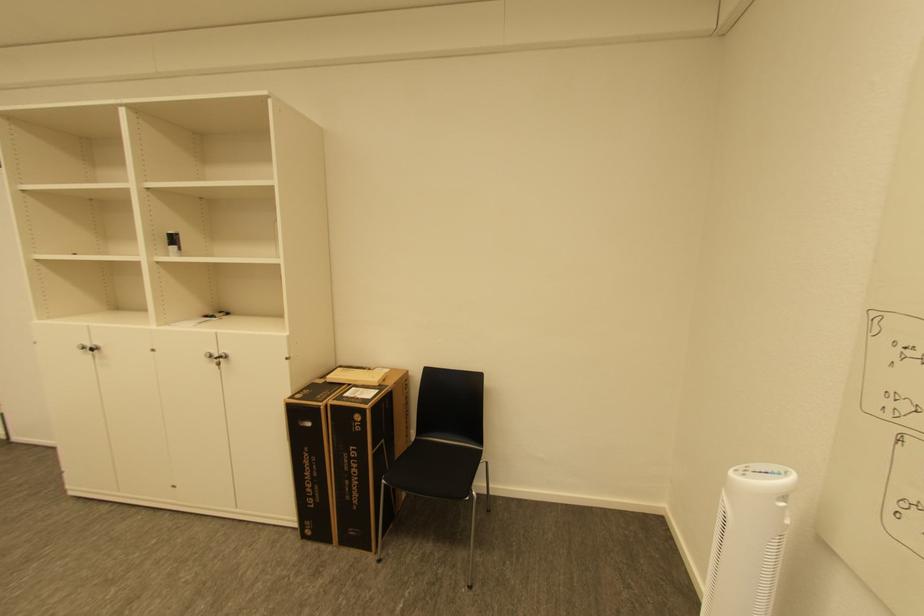
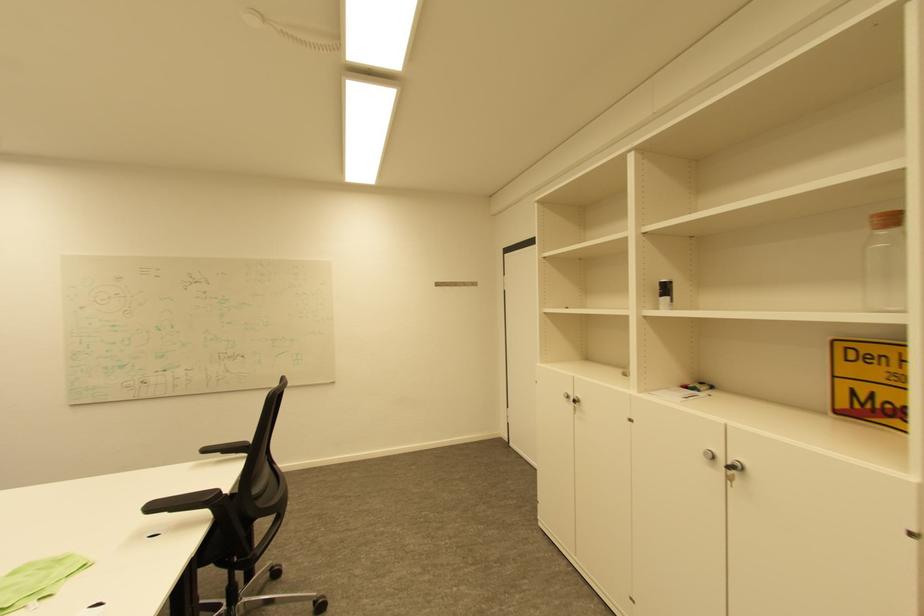
Where in the second image is the point corresponding to pixel 176 245 from the first image?

(667, 296)